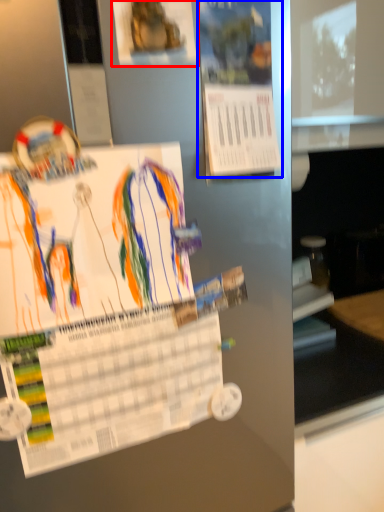
Question: Among these objects, which one is farthest to the camera, poster (highlighted by a red box) or poster (highlighted by a blue box)?

Choices:
 (A) poster
 (B) poster

Answer: (B)